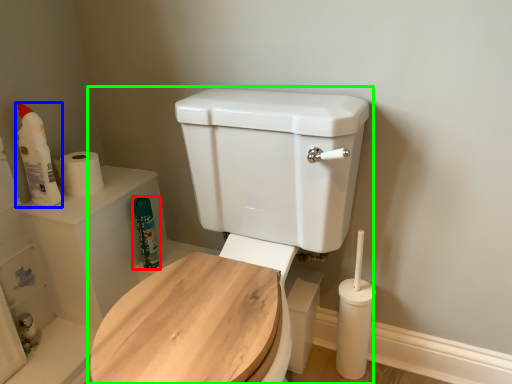
Question: Which object is the farthest from cleaning product (highlighted by a red box)? Choose among these: cleaning product (highlighted by a blue box) or toilet (highlighted by a green box).

Choices:
 (A) cleaning product
 (B) toilet

Answer: (B)